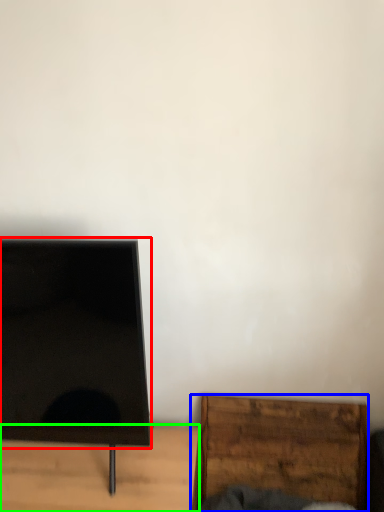
Question: Based on their relative distances, which object is farther from screen (highlighted by a red box)? Choose from furniture (highlighted by a blue box) and furniture (highlighted by a green box).

Choices:
 (A) furniture
 (B) furniture

Answer: (A)